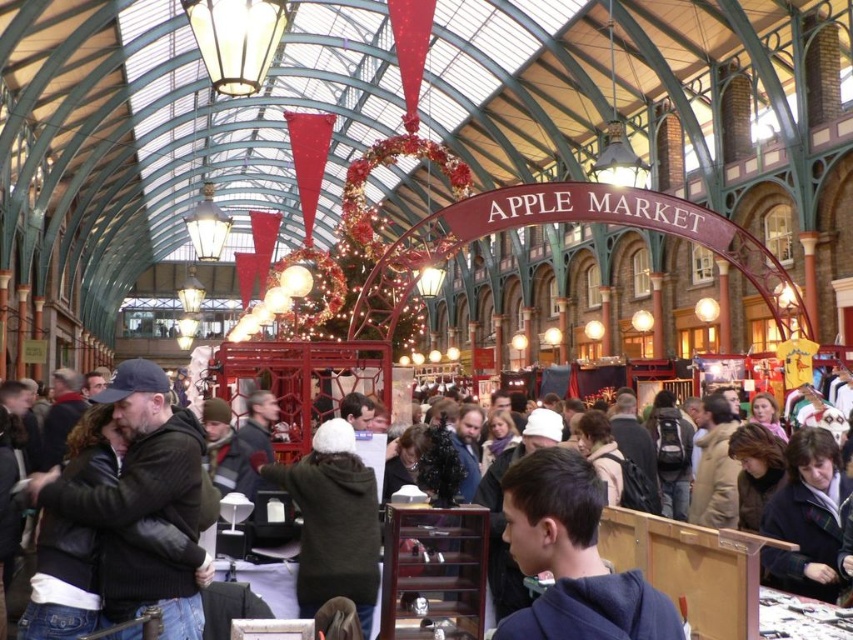
Question: Does dark brown sweater at center appear under dark brown leather jacket at center?

Choices:
 (A) no
 (B) yes

Answer: (B)

Question: Can you confirm if dark blue hoodie at center is positioned below dark brown leather jacket at center?

Choices:
 (A) yes
 (B) no

Answer: (A)

Question: Considering the real-world distances, which object is farthest from the dark brown leather jacket at center?

Choices:
 (A) dark blue hoodie at center
 (B) dark brown sweater at center

Answer: (B)

Question: Which point is closer to the camera taking this photo?

Choices:
 (A) (517, 621)
 (B) (386, 611)
 (C) (57, 492)

Answer: (A)

Question: Is dark blue hoodie at center positioned before dark brown leather jacket at center?

Choices:
 (A) yes
 (B) no

Answer: (A)

Question: Which point is closer to the camera?

Choices:
 (A) dark brown sweater at center
 (B) dark brown leather jacket at center

Answer: (B)